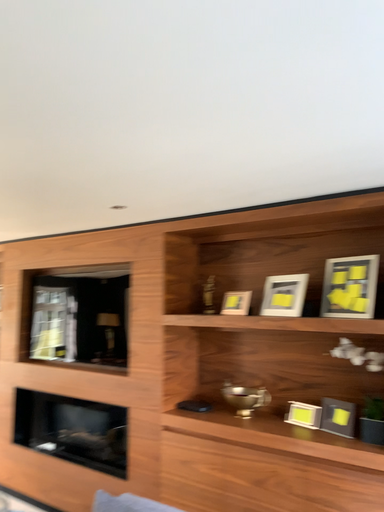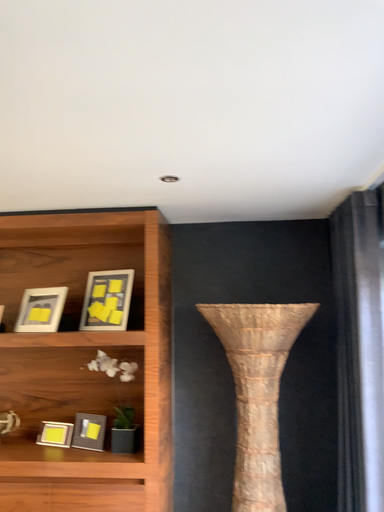
Question: Which way did the camera rotate in the video?

Choices:
 (A) rotated right
 (B) rotated left

Answer: (A)